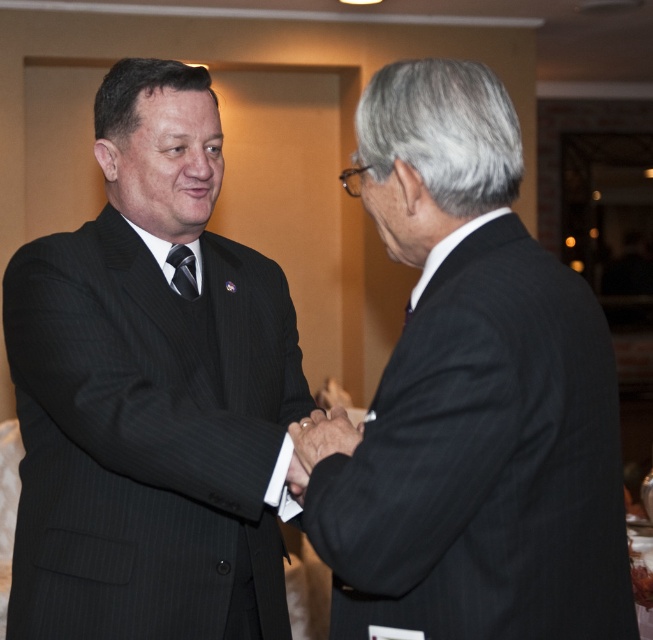
Question: Does black pinstripe suit at center appear on the left side of smooth leather hand at center?

Choices:
 (A) no
 (B) yes

Answer: (B)

Question: Does black pinstripe suit at right appear over black silk tie at center?

Choices:
 (A) yes
 (B) no

Answer: (B)

Question: Is black pinstripe suit at center positioned in front of smooth leather hand at center?

Choices:
 (A) yes
 (B) no

Answer: (B)

Question: Which of these objects is positioned closest to the black pinstripe suit at center?

Choices:
 (A) black pinstripe suit at right
 (B) black silk tie at center
 (C) smooth leather hand at center

Answer: (C)

Question: Which point is closer to the camera?

Choices:
 (A) (471, 428)
 (B) (295, 483)
 (C) (123, 371)
 (D) (193, 262)

Answer: (A)

Question: Estimate the real-world distances between objects in this image. Which object is closer to the smooth leather hand at center?

Choices:
 (A) black pinstripe suit at right
 (B) black silk tie at center
 (C) black pinstripe suit at center

Answer: (A)